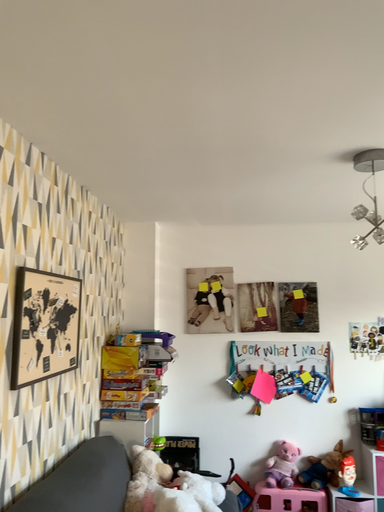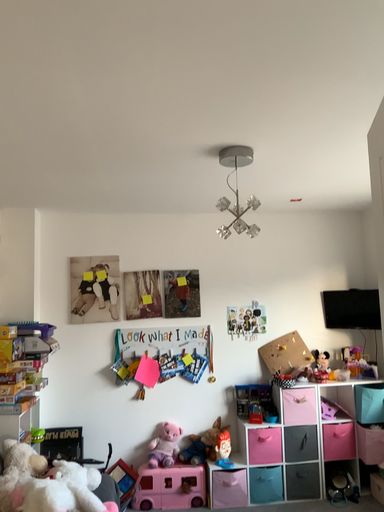
Question: Which way did the camera rotate in the video?

Choices:
 (A) rotated right
 (B) rotated left

Answer: (A)